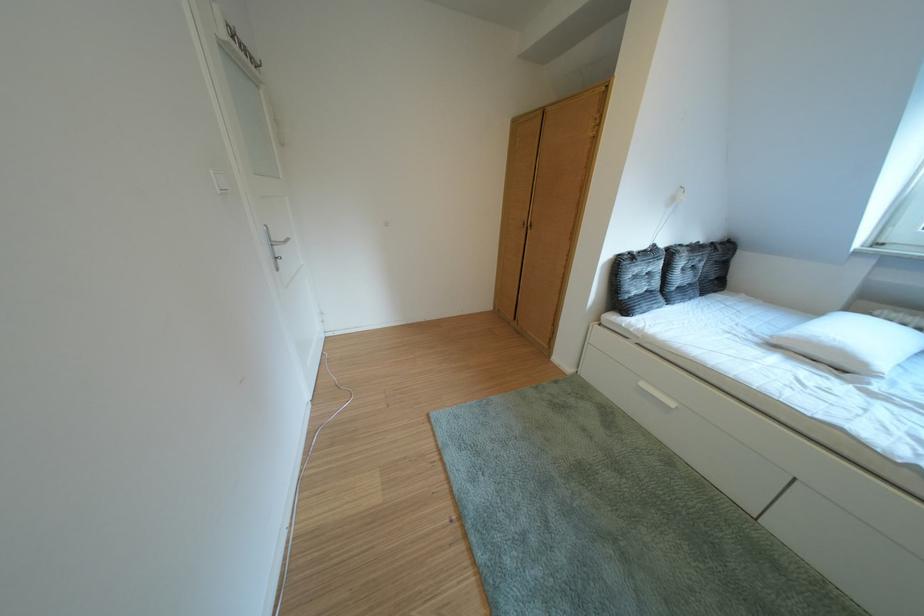
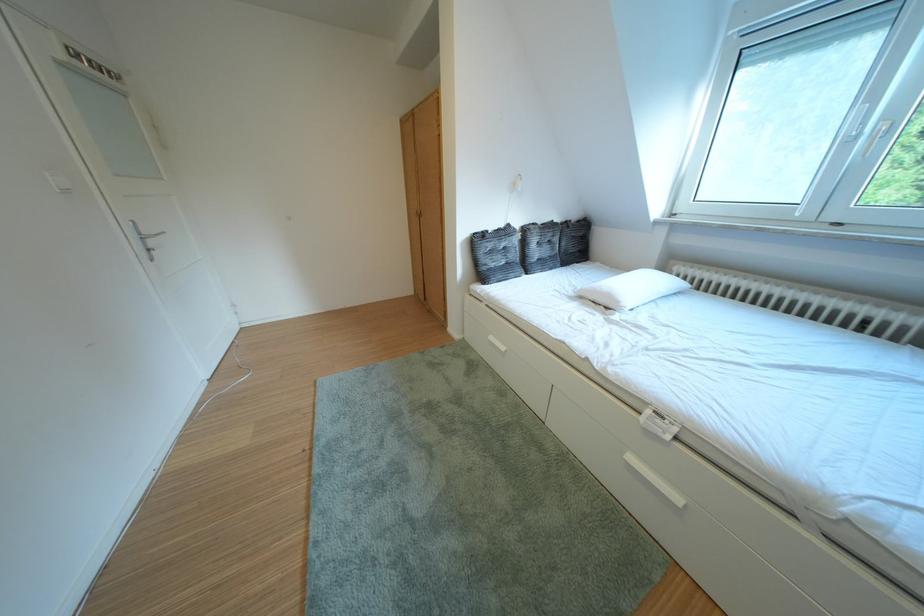
Find the pixel in the second image that matches point (669, 251) in the first image.

(523, 230)